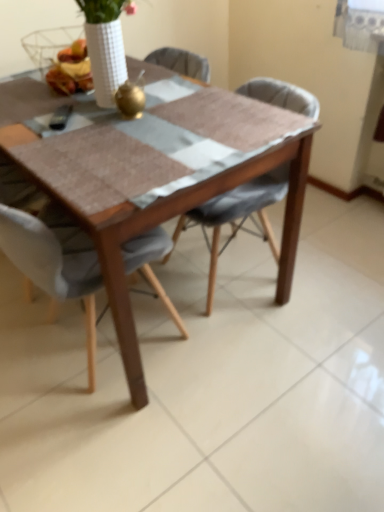
Question: Looking at the image, does light gray fabric chair at center, placed as the first chair when sorted from left to right, seem bigger or smaller compared to wooden table at center?

Choices:
 (A) small
 (B) big

Answer: (A)

Question: From the image's perspective, is light gray fabric chair at center, which appears as the second chair when viewed from the right, located above or below wooden table at center?

Choices:
 (A) below
 (B) above

Answer: (A)

Question: Which is farther from the wooden table at center?

Choices:
 (A) light gray fabric chair at center, placed as the first chair when sorted from left to right
 (B) textured gray chair at center, the second chair from the left
 (C) matte yellow cheese at upper center

Answer: (C)

Question: Considering the real-world distances, which object is farthest from the matte yellow cheese at upper center?

Choices:
 (A) textured gray chair at center, the 1th chair in the right-to-left sequence
 (B) light gray fabric chair at center, which appears as the second chair when viewed from the right
 (C) wooden table at center

Answer: (A)